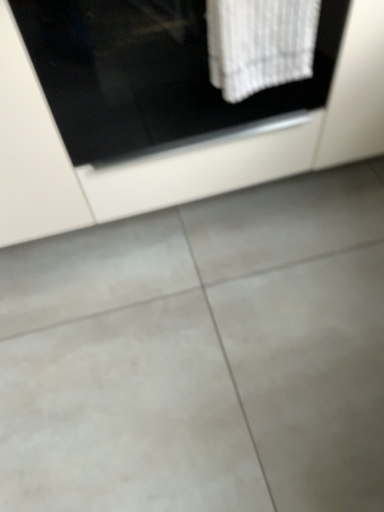
Question: Is white textured towel at upper center inside or outside of white glossy cabinet at upper center?

Choices:
 (A) outside
 (B) inside

Answer: (A)

Question: Considering the positions of white textured towel at upper center and white glossy cabinet at upper center in the image, is white textured towel at upper center bigger or smaller than white glossy cabinet at upper center?

Choices:
 (A) big
 (B) small

Answer: (B)

Question: Which object is the farthest from the gray tile floor at center?

Choices:
 (A) white glossy cabinet at upper center
 (B) white textured towel at upper center

Answer: (B)

Question: Which object is the farthest from the white textured towel at upper center?

Choices:
 (A) white glossy cabinet at upper center
 (B) gray tile floor at center

Answer: (B)